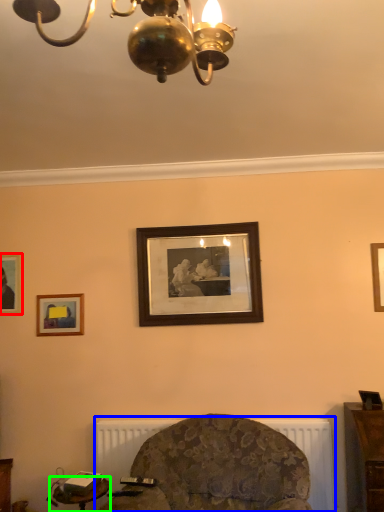
Question: Which object is positioned farthest from picture frame (highlighted by a red box)? Select from radiator (highlighted by a blue box) and table (highlighted by a green box).

Choices:
 (A) radiator
 (B) table

Answer: (A)